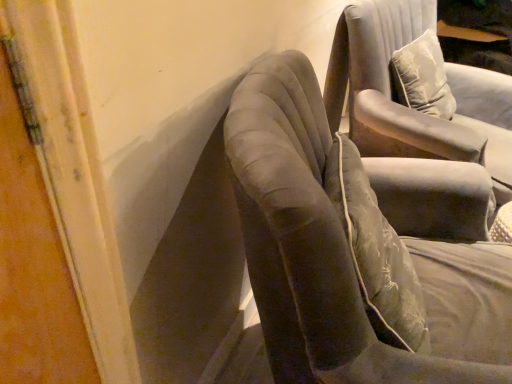
The height and width of the screenshot is (384, 512). What do you see at coordinates (407, 107) in the screenshot?
I see `suede-like gray chair at upper right, which is counted as the 2th chair, starting from the front` at bounding box center [407, 107].

Find the location of a particular element. The image size is (512, 384). suede-like gray chair at upper right, which is counted as the 2th chair, starting from the front is located at coordinates (407, 107).

What do you see at coordinates (350, 255) in the screenshot? The width and height of the screenshot is (512, 384). I see `velvet gray chair at center, which is counted as the second chair, starting from the back` at bounding box center [350, 255].

This screenshot has width=512, height=384. I want to click on velvet gray chair at center, positioned as the first chair in front-to-back order, so click(350, 255).

Where is `suede-like gray chair at upper right, placed as the first chair when sorted from back to front`? The image size is (512, 384). suede-like gray chair at upper right, placed as the first chair when sorted from back to front is located at coordinates (407, 107).

Which object is positioned more to the left, suede-like gray chair at upper right, which is counted as the 2th chair, starting from the front, or velvet gray chair at center, positioned as the first chair in front-to-back order?

Positioned to the left is velvet gray chair at center, positioned as the first chair in front-to-back order.

Who is more distant, suede-like gray chair at upper right, placed as the first chair when sorted from back to front, or velvet gray chair at center, which is counted as the second chair, starting from the back?

suede-like gray chair at upper right, placed as the first chair when sorted from back to front, is behind.

Is point (417, 137) behind point (294, 245)?

Yes, point (417, 137) is farther from viewer.

From the image's perspective, who appears lower, suede-like gray chair at upper right, which is counted as the 2th chair, starting from the front, or velvet gray chair at center, which is counted as the second chair, starting from the back?

velvet gray chair at center, which is counted as the second chair, starting from the back, appears lower in the image.

From a real-world perspective, is suede-like gray chair at upper right, which is counted as the 2th chair, starting from the front, above or below velvet gray chair at center, positioned as the first chair in front-to-back order?

suede-like gray chair at upper right, which is counted as the 2th chair, starting from the front, is situated higher than velvet gray chair at center, positioned as the first chair in front-to-back order, in the real world.

Considering the sizes of objects suede-like gray chair at upper right, which is counted as the 2th chair, starting from the front, and velvet gray chair at center, which is counted as the second chair, starting from the back, in the image provided, who is thinner, suede-like gray chair at upper right, which is counted as the 2th chair, starting from the front, or velvet gray chair at center, which is counted as the second chair, starting from the back,?

Thinner between the two is suede-like gray chair at upper right, which is counted as the 2th chair, starting from the front.

Who is shorter, suede-like gray chair at upper right, which is counted as the 2th chair, starting from the front, or velvet gray chair at center, which is counted as the second chair, starting from the back?

suede-like gray chair at upper right, which is counted as the 2th chair, starting from the front, is shorter.

Is suede-like gray chair at upper right, placed as the first chair when sorted from back to front, bigger than velvet gray chair at center, positioned as the first chair in front-to-back order?

No, suede-like gray chair at upper right, placed as the first chair when sorted from back to front, is not bigger than velvet gray chair at center, positioned as the first chair in front-to-back order.

Would you say suede-like gray chair at upper right, placed as the first chair when sorted from back to front, contains velvet gray chair at center, which is counted as the second chair, starting from the back?

No, velvet gray chair at center, which is counted as the second chair, starting from the back, is not inside suede-like gray chair at upper right, placed as the first chair when sorted from back to front.

Are suede-like gray chair at upper right, placed as the first chair when sorted from back to front, and velvet gray chair at center, positioned as the first chair in front-to-back order, beside each other?

No, suede-like gray chair at upper right, placed as the first chair when sorted from back to front, is not making contact with velvet gray chair at center, positioned as the first chair in front-to-back order.

Could you tell me if suede-like gray chair at upper right, which is counted as the 2th chair, starting from the front, is facing velvet gray chair at center, which is counted as the second chair, starting from the back?

No, suede-like gray chair at upper right, which is counted as the 2th chair, starting from the front, is not aimed at velvet gray chair at center, which is counted as the second chair, starting from the back.

How different are the orientations of suede-like gray chair at upper right, which is counted as the 2th chair, starting from the front, and velvet gray chair at center, which is counted as the second chair, starting from the back, in degrees?

The facing directions of suede-like gray chair at upper right, which is counted as the 2th chair, starting from the front, and velvet gray chair at center, which is counted as the second chair, starting from the back, are 39.6 degrees apart.

How far apart are suede-like gray chair at upper right, placed as the first chair when sorted from back to front, and velvet gray chair at center, which is counted as the second chair, starting from the back?

They are 27.84 inches apart.

Where is `chair in front of the suede-like gray chair at upper right, which is counted as the 2th chair, starting from the front`? chair in front of the suede-like gray chair at upper right, which is counted as the 2th chair, starting from the front is located at coordinates (350, 255).

Which is more to the left, velvet gray chair at center, positioned as the first chair in front-to-back order, or suede-like gray chair at upper right, which is counted as the 2th chair, starting from the front?

velvet gray chair at center, positioned as the first chair in front-to-back order, is more to the left.

Which is behind, velvet gray chair at center, which is counted as the second chair, starting from the back, or suede-like gray chair at upper right, placed as the first chair when sorted from back to front?

suede-like gray chair at upper right, placed as the first chair when sorted from back to front, is behind.

Between point (330, 197) and point (406, 147), which one is positioned in front?

The point (330, 197) is closer to the camera.

From the image's perspective, would you say velvet gray chair at center, positioned as the first chair in front-to-back order, is shown under suede-like gray chair at upper right, placed as the first chair when sorted from back to front?

Yes, from the image's perspective, velvet gray chair at center, positioned as the first chair in front-to-back order, is below suede-like gray chair at upper right, placed as the first chair when sorted from back to front.

From the picture: From a real-world perspective, is velvet gray chair at center, which is counted as the second chair, starting from the back, positioned over suede-like gray chair at upper right, which is counted as the 2th chair, starting from the front, based on gravity?

No.

Which object is wider, velvet gray chair at center, positioned as the first chair in front-to-back order, or suede-like gray chair at upper right, placed as the first chair when sorted from back to front?

velvet gray chair at center, positioned as the first chair in front-to-back order, is wider.

Can you confirm if velvet gray chair at center, which is counted as the second chair, starting from the back, is shorter than suede-like gray chair at upper right, which is counted as the 2th chair, starting from the front?

No, velvet gray chair at center, which is counted as the second chair, starting from the back, is not shorter than suede-like gray chair at upper right, which is counted as the 2th chair, starting from the front.

Is velvet gray chair at center, which is counted as the second chair, starting from the back, bigger or smaller than suede-like gray chair at upper right, which is counted as the 2th chair, starting from the front?

Considering their sizes, velvet gray chair at center, which is counted as the second chair, starting from the back, takes up more space than suede-like gray chair at upper right, which is counted as the 2th chair, starting from the front.

Is velvet gray chair at center, which is counted as the second chair, starting from the back, completely or partially outside of suede-like gray chair at upper right, placed as the first chair when sorted from back to front?

Yes, velvet gray chair at center, which is counted as the second chair, starting from the back, is outside of suede-like gray chair at upper right, placed as the first chair when sorted from back to front.

Would you consider velvet gray chair at center, positioned as the first chair in front-to-back order, to be distant from suede-like gray chair at upper right, which is counted as the 2th chair, starting from the front?

No, velvet gray chair at center, positioned as the first chair in front-to-back order, is not far from suede-like gray chair at upper right, which is counted as the 2th chair, starting from the front.

Does velvet gray chair at center, positioned as the first chair in front-to-back order, turn towards suede-like gray chair at upper right, placed as the first chair when sorted from back to front?

No, velvet gray chair at center, positioned as the first chair in front-to-back order, is not turned towards suede-like gray chair at upper right, placed as the first chair when sorted from back to front.

How much distance is there between velvet gray chair at center, which is counted as the second chair, starting from the back, and suede-like gray chair at upper right, which is counted as the 2th chair, starting from the front?

velvet gray chair at center, which is counted as the second chair, starting from the back, and suede-like gray chair at upper right, which is counted as the 2th chair, starting from the front, are 27.84 inches apart from each other.

Identify the location of chair behind the velvet gray chair at center, which is counted as the second chair, starting from the back. This screenshot has width=512, height=384. (407, 107).

Image resolution: width=512 pixels, height=384 pixels. In order to click on chair that appears on the left of suede-like gray chair at upper right, which is counted as the 2th chair, starting from the front in this screenshot , I will do [x=350, y=255].

Find the location of `chair that is on the right side of velvet gray chair at center, positioned as the first chair in front-to-back order`. chair that is on the right side of velvet gray chair at center, positioned as the first chair in front-to-back order is located at coordinates (407, 107).